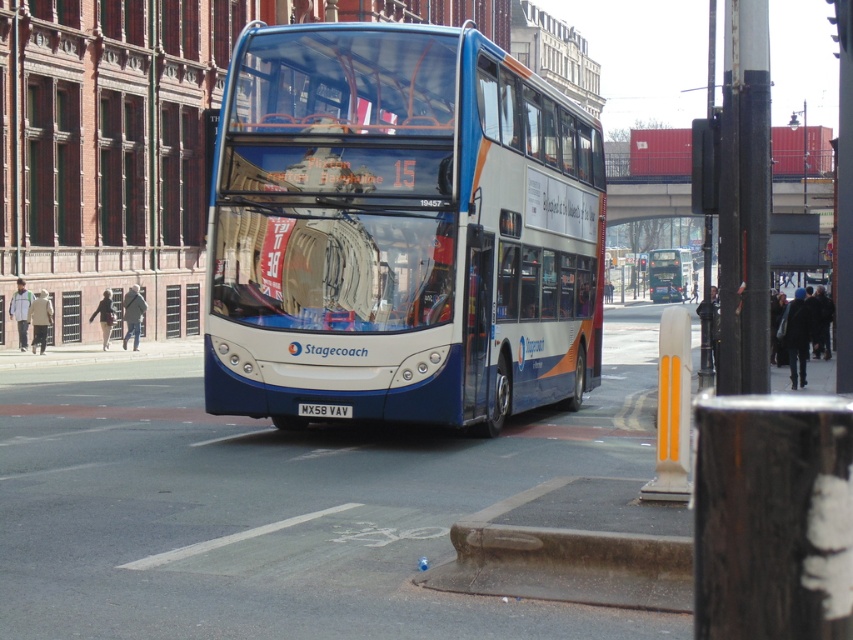
Does white glossy bus at center appear on the right side of black plastic license plate at center?

Yes, white glossy bus at center is to the right of black plastic license plate at center.

Is white glossy bus at center taller than black plastic license plate at center?

Indeed, white glossy bus at center has a greater height compared to black plastic license plate at center.

Who is more distant from viewer, (664, 291) or (349, 408)?

The point (664, 291) is more distant.

Locate an element on the screen. white glossy bus at center is located at coordinates (669, 275).

Which is behind, point (496, 68) or point (688, 253)?

The point (688, 253) is behind.

Who is more forward, (283, 406) or (659, 291)?

Point (283, 406) is in front.

Between point (425, 32) and point (671, 298), which one is positioned in front?

Point (425, 32)

Where is `blue metallic bus at center`? blue metallic bus at center is located at coordinates (399, 230).

Is point (519, 237) positioned before point (351, 410)?

No, it is not.

Image resolution: width=853 pixels, height=640 pixels. What do you see at coordinates (399, 230) in the screenshot?
I see `blue metallic bus at center` at bounding box center [399, 230].

Is point (437, 344) closer to camera compared to point (322, 408)?

That is True.

This screenshot has width=853, height=640. Identify the location of blue metallic bus at center. (399, 230).